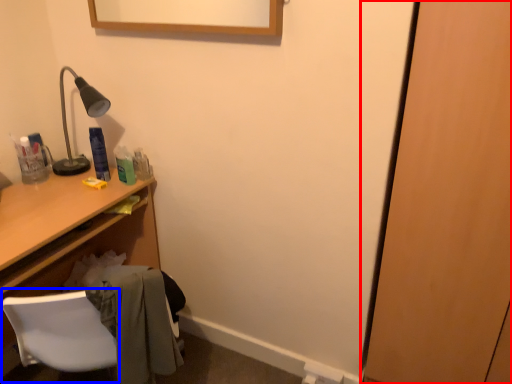
Question: Which object is further to the camera taking this photo, door (highlighted by a red box) or computer chair (highlighted by a blue box)?

Choices:
 (A) door
 (B) computer chair

Answer: (B)